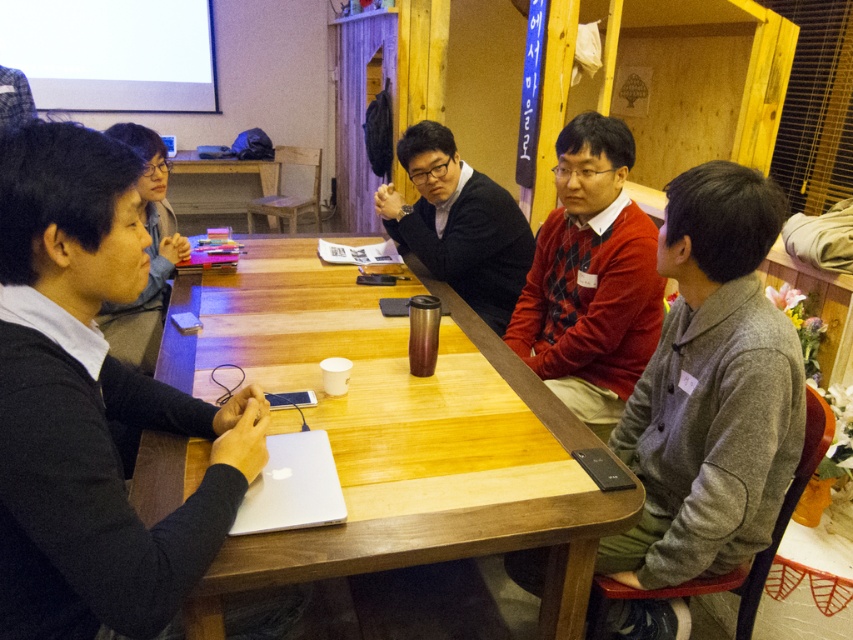
Measure the distance between red sweater at center and wooden table at center.

14.63 feet

Which is in front, point (625, 380) or point (189, 186)?

Positioned in front is point (625, 380).

This screenshot has width=853, height=640. Identify the location of red sweater at center. [590, 278].

Where is `red sweater at center`? red sweater at center is located at coordinates (590, 278).

Who is positioned more to the right, black matte sweater at left or silver metallic laptop at upper left?

black matte sweater at left

Who is more forward, (x=215, y=524) or (x=167, y=141)?

Positioned in front is point (x=215, y=524).

Who is more forward, (202, 550) or (173, 156)?

Point (202, 550) is more forward.

Identify the location of black matte sweater at left. The image size is (853, 640). (91, 406).

Is point (321, 444) positioned in front of point (177, 168)?

Yes.

Can you confirm if silver metallic laptop at lower left is wider than wooden table at center?

No.

Is point (322, 499) closer to camera compared to point (171, 195)?

Yes.

At what (x,y) coordinates should I click in order to perform the action: click on silver metallic laptop at lower left. Please return your answer as a coordinate pair (x, y). The image size is (853, 640). Looking at the image, I should click on (292, 486).